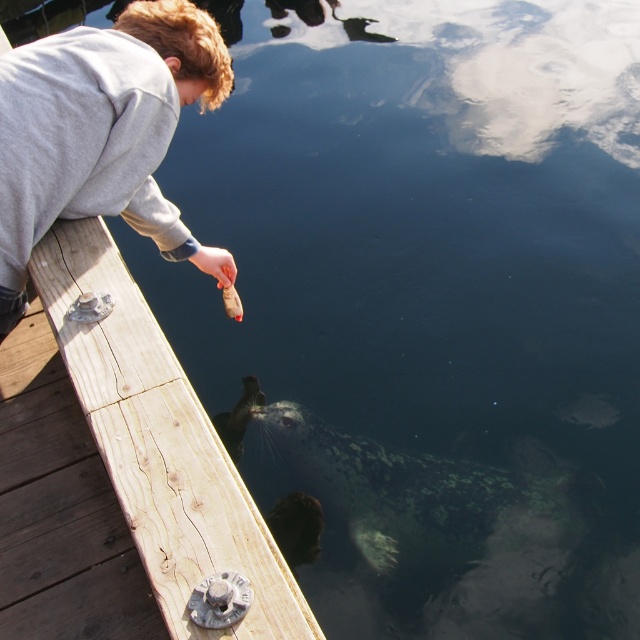
You are standing at the edge of the dock and want to toss a small treat to the seal. The treat must land exactly at point (x=81, y=272). Given that you can throw the treat up to 2 meters, will you be able to reach that spot?

The distance between you and point (x=81, y=272) is 2.13 meters, which exceeds your throwing range of 2 meters. Therefore, you cannot reach that spot.

In the scene shown: You are standing on the brown wooden dock at lower left and want to reach the gray matte sweatshirt at upper left. Can you climb up directly from the dock to the sweatshirt?

The brown wooden dock at lower left is below the gray matte sweatshirt at upper left, so yes, you can climb up directly from the dock to the sweatshirt.

You are a photographer trying to capture a closeup shot of the gray matte sweatshirt at upper left and the brown wooden dock at lower left. Given that your camera can only focus on objects within 18 inches, will both subjects be in focus?

The brown wooden dock at lower left is 18.86 inches away from the gray matte sweatshirt at upper left. Since the camera can only focus within 18 inches, the distance between them exceeds the focus range, so both subjects cannot be in focus simultaneously.